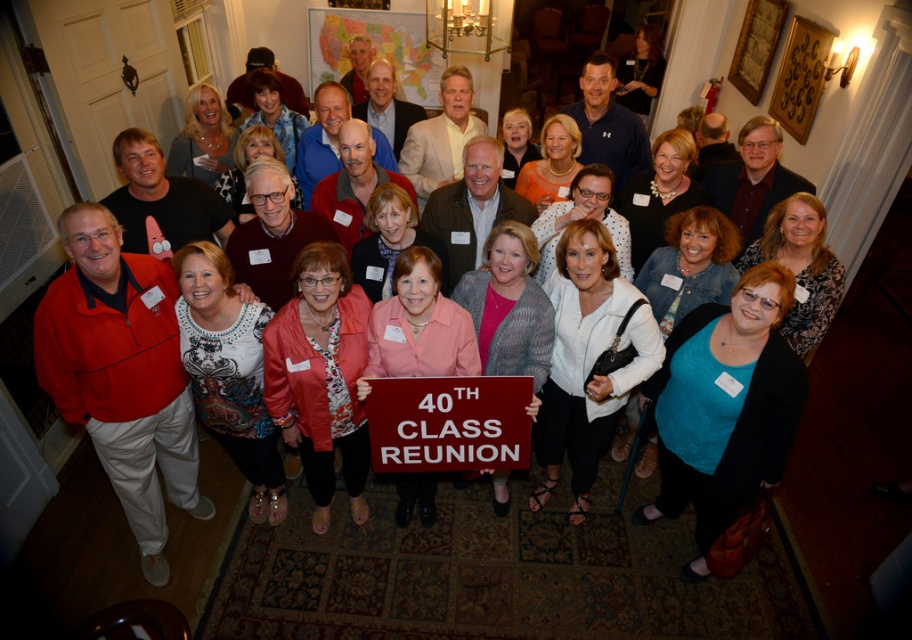
Is teal jersey at center wider than white textured sweater at center?

No, teal jersey at center is not wider than white textured sweater at center.

Between point (774, 461) and point (608, 253), which one is positioned in front?

Point (774, 461) is more forward.

The image size is (912, 640). What are the coordinates of `teal jersey at center` in the screenshot? It's located at (724, 406).

Is point (764, 220) positioned behind point (417, 145)?

No, it is in front of (417, 145).

Is point (814, 186) in front of point (451, 83)?

Yes, it is in front of point (451, 83).

The height and width of the screenshot is (640, 912). Describe the element at coordinates (752, 179) in the screenshot. I see `matte black shirt at center` at that location.

The height and width of the screenshot is (640, 912). In order to click on matte black shirt at center in this screenshot , I will do `click(752, 179)`.

Is point (99, 412) in front of point (575, 275)?

No, it is not.

The image size is (912, 640). Describe the element at coordinates (122, 374) in the screenshot. I see `matte red jacket at center` at that location.

Image resolution: width=912 pixels, height=640 pixels. Identify the location of matte red jacket at center. (122, 374).